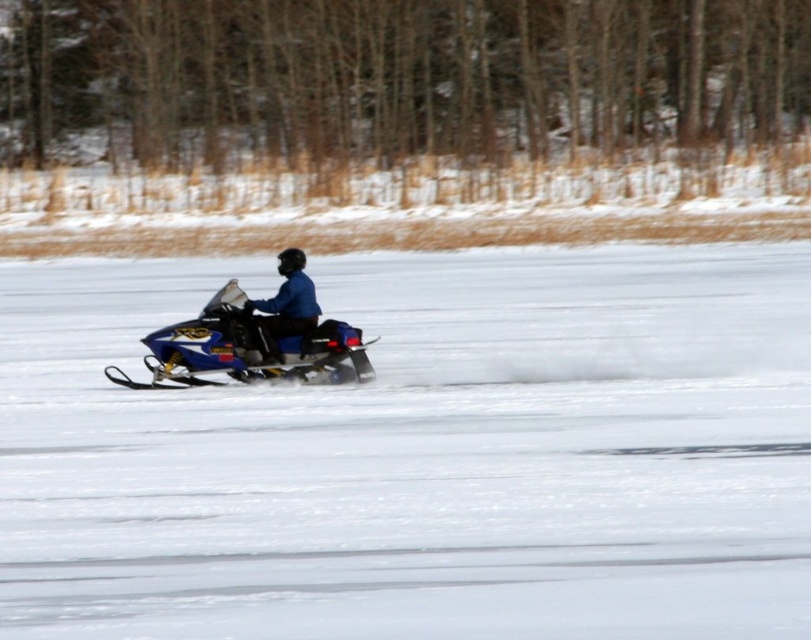
You are planning to transport a large package that requires a taller vehicle. You have two snowmobiles available in the scene, the blue metallic snowmobile at center and the blue matte snowmobile at center. Which one should you choose?

The blue matte snowmobile at center is taller than the blue metallic snowmobile at center, so you should choose the blue matte snowmobile at center for transporting the large package that requires a taller vehicle.

You are planning to transport a large equipment box that requires a vehicle with a minimum width of 2 meters. You have access to both the blue metallic snowmobile at center and the blue matte snowmobile at center. Based on the scene, which snowmobile would be suitable for your equipment?

The blue metallic snowmobile at center might be wider than blue matte snowmobile at center, so it could be suitable for transporting the large equipment box if its width meets or exceeds the 2 meter requirement.